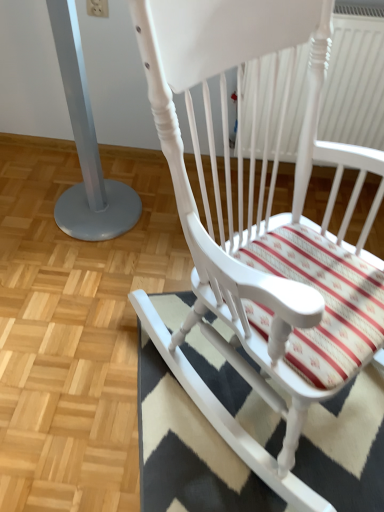
Locate an element on the screen. free spot above black-and-white striped rug at lower right (from a real-world perspective) is located at coordinates coord(256,412).